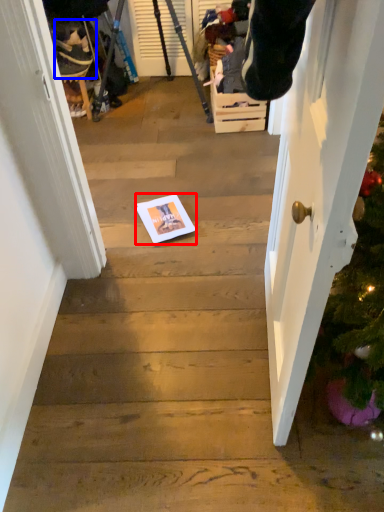
Question: Among these objects, which one is nearest to the camera, copy (highlighted by a red box) or person (highlighted by a blue box)?

Choices:
 (A) copy
 (B) person

Answer: (A)